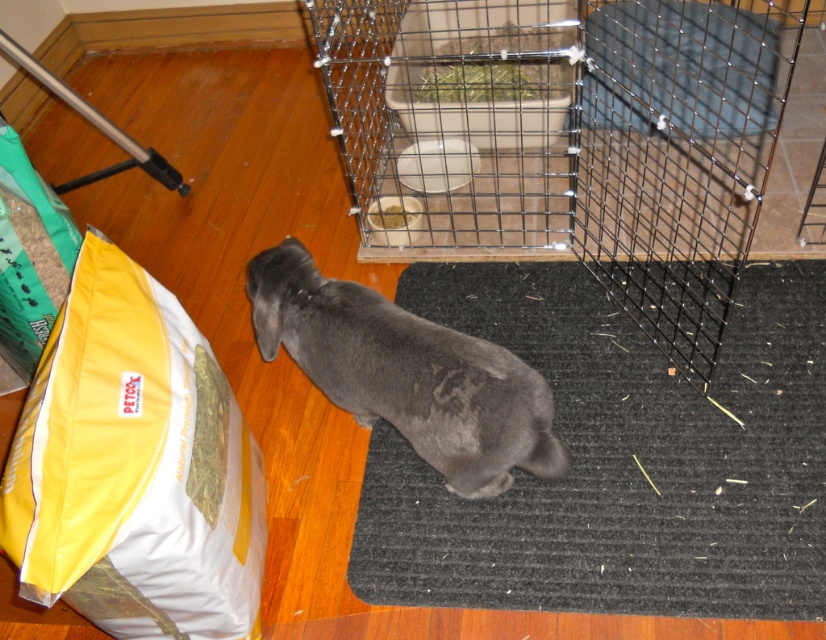
You are a pet owner who wants to place the green paper bag at left on a shelf above the gray matte dog at center. Is the shelf above the dog high enough to hold the bag?

The gray matte dog at center is below the green paper bag at left, so the shelf above the dog would be higher than the dog, but since the bag is already positioned to the left and the dog is below it, the shelf must be at least as high as the current position of the green paper bag at left to accommodate it. However, without knowing the exact height of the shelf, we can only confirm their relative positions as described.

You are a pet owner who wants to place the green paper bag at left closer to the gray matte dog at center. How far apart are they currently?

The gray matte dog at center is 22.89 inches away from the green paper bag at left, so they are currently 22.89 inches apart.

You are a pet owner who wants to place the smooth metal tray at upper center into the black wire cage at center. Based on the scene description, will the tray fit inside the cage?

The black wire cage at center is larger in size than the smooth metal tray at upper center, so the tray should fit inside the cage.